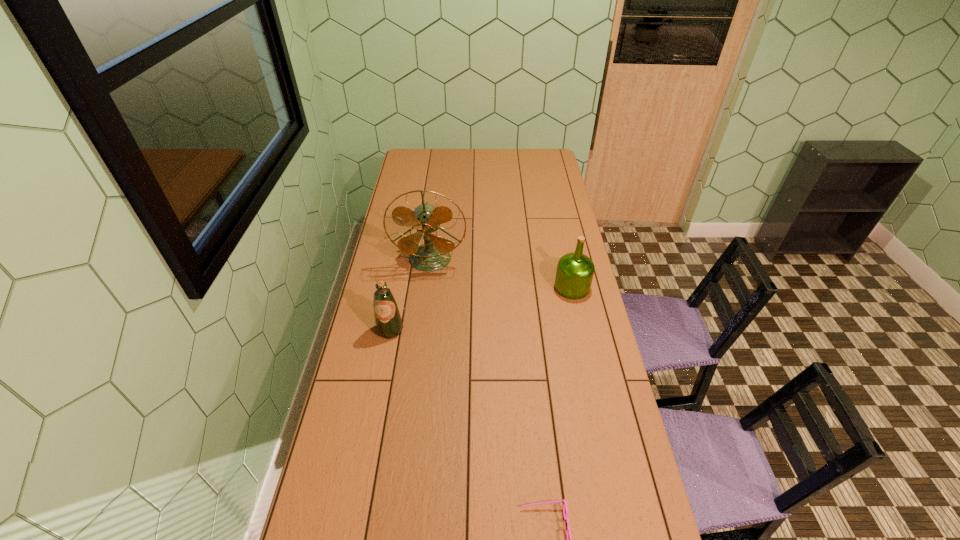
Identify the location of object that is positioned at the right edge. (574, 274).

This screenshot has width=960, height=540. What are the coordinates of `free space at the far edge of the desktop` in the screenshot? It's located at (479, 154).

Locate an element on the screen. The width and height of the screenshot is (960, 540). free region at the left edge is located at coordinates (337, 477).

Image resolution: width=960 pixels, height=540 pixels. In order to click on vacant area at the right edge of the desktop in this screenshot , I will do `click(575, 224)`.

At what (x,y) coordinates should I click in order to perform the action: click on vacant position at the far right corner of the desktop. Please return your answer as a coordinate pair (x, y). This screenshot has height=540, width=960. Looking at the image, I should click on (550, 160).

This screenshot has width=960, height=540. In order to click on free area in between the rightmost object and the left olive oil in this screenshot , I will do (481, 308).

Where is `unoccupied position between the rightmost object and the third farthest object`? unoccupied position between the rightmost object and the third farthest object is located at coordinates coord(481,308).

This screenshot has height=540, width=960. In order to click on vacant area between the farther olive oil and the fan in this screenshot , I will do `click(501, 273)`.

Where is `free space between the left olive oil and the right olive oil`? This screenshot has width=960, height=540. free space between the left olive oil and the right olive oil is located at coordinates click(481, 308).

The width and height of the screenshot is (960, 540). Find the location of `free point between the rightmost object and the nearer olive oil`. free point between the rightmost object and the nearer olive oil is located at coordinates (481, 308).